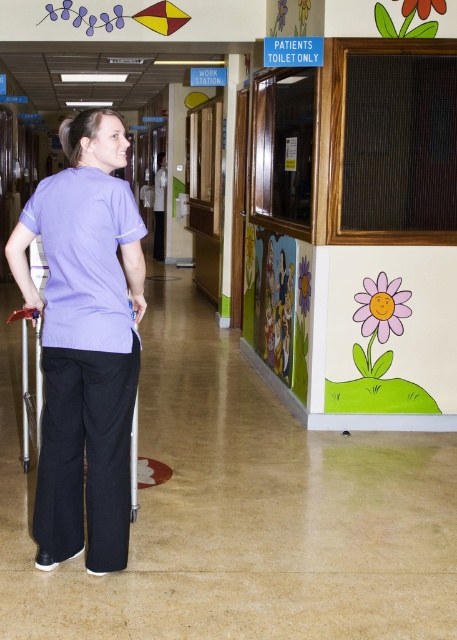
Between matte purple shirt at center and matte plastic walker at center, which one is positioned higher?

matte plastic walker at center

What do you see at coordinates (85, 340) in the screenshot? This screenshot has width=457, height=640. I see `matte purple shirt at center` at bounding box center [85, 340].

Image resolution: width=457 pixels, height=640 pixels. Describe the element at coordinates (85, 340) in the screenshot. I see `matte purple shirt at center` at that location.

Locate an element on the screen. The image size is (457, 640). matte purple shirt at center is located at coordinates (85, 340).